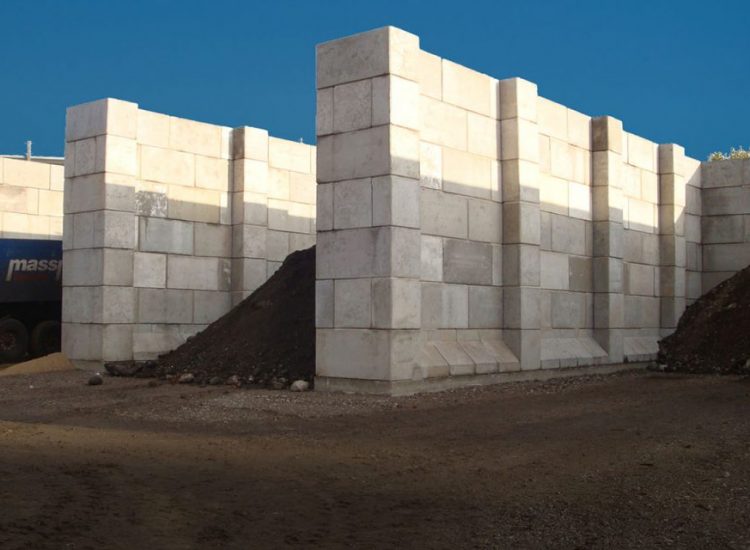
Locate an element on the screen. The width and height of the screenshot is (750, 550). block wall left is located at coordinates tap(15, 191).